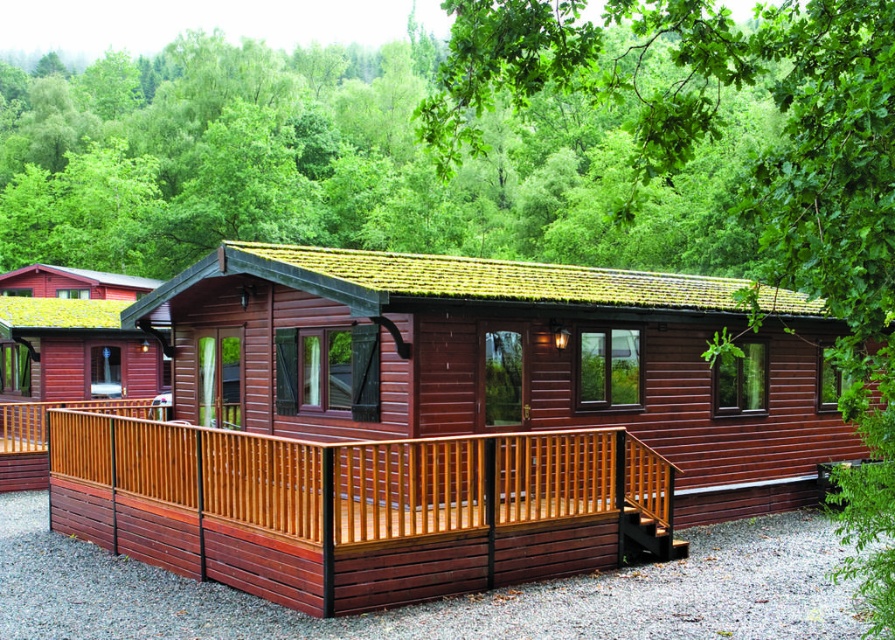
From the picture: You are standing on the wooden deck at lower center and want to see the view beyond the green leafy tree at upper center. Can you see the tree blocking your view? Please explain.

The green leafy tree at upper center is behind the wooden deck at lower center, so the tree is not blocking your view from the deck. You can see the view beyond the tree.

You are standing in front of the cabin and want to take a photo of both the matte wood log cabin at center and the green leafy tree at upper center. Based on their sizes, which one should you zoom in on more to ensure both fit in the frame?

The matte wood log cabin at center is smaller than the green leafy tree at upper center, so you should zoom in more on the cabin to ensure both fit in the frame.

You are standing at the entrance of the wooden cabin and want to walk to the green leafy tree at upper center. Which direction should you move relative to the wooden deck at lower center?

You should move to the right of the wooden deck at lower center to reach the green leafy tree at upper center since the wooden deck at lower center is to the left of the green leafy tree at upper center.